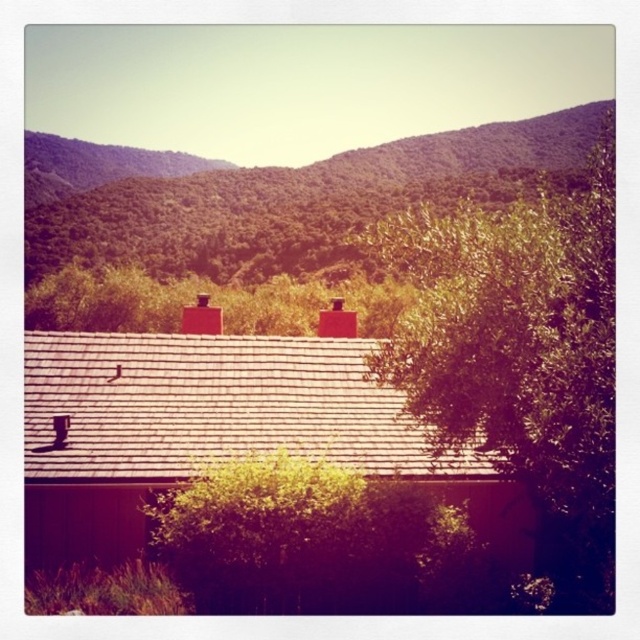
Question: Can you confirm if green leafy tree at right is positioned to the right of green leafy tree at center?

Choices:
 (A) yes
 (B) no

Answer: (A)

Question: Can you confirm if green leafy hillside at upper center is positioned to the left of green leafy tree at center?

Choices:
 (A) yes
 (B) no

Answer: (B)

Question: Which of these objects is positioned farthest from the green leafy tree at right?

Choices:
 (A) green leafy hillside at upper center
 (B) green leafy tree at center

Answer: (A)

Question: Which point is farther to the camera?

Choices:
 (A) (262, 234)
 (B) (256, 589)

Answer: (A)

Question: Which point is closer to the camera?

Choices:
 (A) (333, 212)
 (B) (324, 486)

Answer: (B)

Question: Can you confirm if green leafy tree at right is thinner than green leafy hillside at upper center?

Choices:
 (A) no
 (B) yes

Answer: (B)